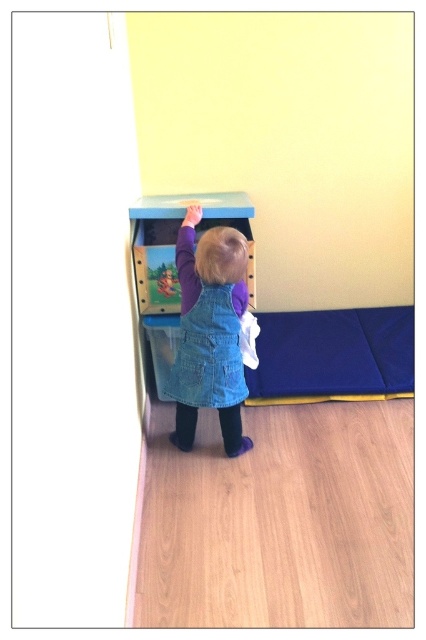
You are a robot navigating a playroom. You need to move from the point at coordinates point (221, 360) to the point at coordinates point (209, 296). According to the scene, which direction should you move to reach your destination?

To move from point (221, 360) to point (209, 296), you should move forward because point (221, 360) is behind point (209, 296), meaning the destination is in front of the starting point.

The child is wearing two items of clothing. Which one is closer to you, the denim dress at center or the denim overalls at center?

The denim dress at center is in front of the denim overalls at center, so the denim dress at center is closer to you.